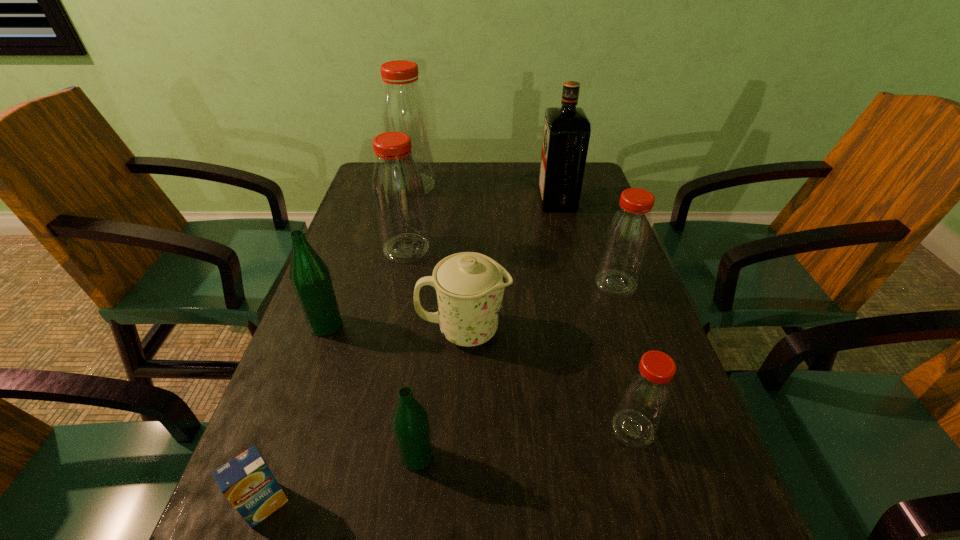
The image size is (960, 540). Identify the location of the farthest red bottle. (403, 108).

Locate an element on the screen. Image resolution: width=960 pixels, height=540 pixels. the biggest red bottle is located at coordinates (403, 108).

The height and width of the screenshot is (540, 960). I want to click on liquor, so click(x=566, y=133).

Identify the location of the fifth nearest bottle. (398, 192).

This screenshot has height=540, width=960. I want to click on the second farthest red bottle, so click(398, 192).

Where is `the third farthest red bottle`? This screenshot has height=540, width=960. the third farthest red bottle is located at coordinates (627, 238).

This screenshot has width=960, height=540. In order to click on the second smallest red bottle in this screenshot , I will do `click(627, 238)`.

Identify the location of the left green bottle. This screenshot has height=540, width=960. (310, 277).

At what (x,y) coordinates should I click in order to perform the action: click on the bigger green bottle. Please return your answer as a coordinate pair (x, y). This screenshot has height=540, width=960. Looking at the image, I should click on (310, 277).

Where is `chinaware`? chinaware is located at coordinates (469, 286).